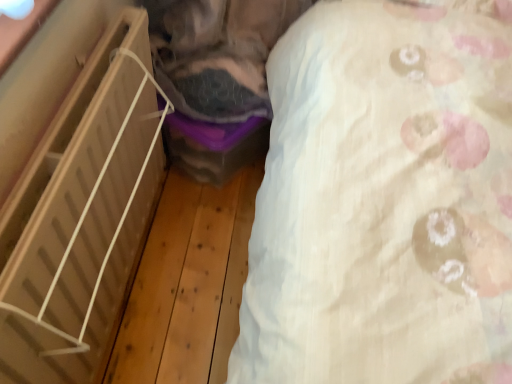
Where is `white textured sheet at upper right`? The width and height of the screenshot is (512, 384). white textured sheet at upper right is located at coordinates (384, 200).

This screenshot has width=512, height=384. What do you see at coordinates (384, 200) in the screenshot?
I see `white textured sheet at upper right` at bounding box center [384, 200].

Measure the distance between point (157, 134) and camera.

Point (157, 134) and camera are 4.38 feet apart.

This screenshot has height=384, width=512. What do you see at coordinates (80, 216) in the screenshot?
I see `light wood shelf at left` at bounding box center [80, 216].

At what (x,y) coordinates should I click in order to perform the action: click on light wood shelf at left. Please return your answer as a coordinate pair (x, y). Looking at the image, I should click on (80, 216).

This screenshot has width=512, height=384. Identify the location of white textured sheet at upper right. (384, 200).

Does light wood shelf at left appear on the right side of white textured sheet at upper right?

Incorrect, light wood shelf at left is not on the right side of white textured sheet at upper right.

Is light wood shelf at left in front of or behind white textured sheet at upper right in the image?

light wood shelf at left is behind white textured sheet at upper right.

Is point (25, 218) farther from viewer compared to point (430, 176)?

No, (25, 218) is closer to viewer.

From the image's perspective, would you say light wood shelf at left is shown under white textured sheet at upper right?

Yes, from the image's perspective, light wood shelf at left is below white textured sheet at upper right.

From a real-world perspective, is light wood shelf at left positioned over white textured sheet at upper right based on gravity?

Incorrect, from a real-world perspective, light wood shelf at left is lower than white textured sheet at upper right.

Considering the sizes of objects light wood shelf at left and white textured sheet at upper right in the image provided, who is thinner, light wood shelf at left or white textured sheet at upper right?

Thinner between the two is white textured sheet at upper right.

Considering the sizes of objects light wood shelf at left and white textured sheet at upper right in the image provided, who is taller, light wood shelf at left or white textured sheet at upper right?

With more height is white textured sheet at upper right.

Is light wood shelf at left bigger or smaller than white textured sheet at upper right?

In the image, light wood shelf at left appears to be larger than white textured sheet at upper right.

Is light wood shelf at left inside the boundaries of white textured sheet at upper right, or outside?

light wood shelf at left is not enclosed by white textured sheet at upper right.

Does light wood shelf at left touch white textured sheet at upper right?

They are not placed beside each other.

Is white textured sheet at upper right at the back of light wood shelf at left?

No, white textured sheet at upper right is not at the back of light wood shelf at left.

Measure the distance from light wood shelf at left to white textured sheet at upper right.

They are 20.95 inches apart.

The height and width of the screenshot is (384, 512). Find the location of `furniture behind the white textured sheet at upper right`. furniture behind the white textured sheet at upper right is located at coordinates (80, 216).

Which is more to the right, white textured sheet at upper right or light wood shelf at left?

white textured sheet at upper right.

Relative to light wood shelf at left, is white textured sheet at upper right in front or behind?

In the image, white textured sheet at upper right appears in front of light wood shelf at left.

Considering the positions of point (358, 340) and point (148, 184), is point (358, 340) closer or farther from the camera than point (148, 184)?

Point (358, 340).

From the image's perspective, is white textured sheet at upper right above or below light wood shelf at left?

Clearly, from the image's perspective, white textured sheet at upper right is above light wood shelf at left.

From a real-world perspective, is white textured sheet at upper right physically above light wood shelf at left?

Yes.

Between white textured sheet at upper right and light wood shelf at left, which one has larger width?

light wood shelf at left.

Which of these two, white textured sheet at upper right or light wood shelf at left, stands shorter?

With less height is light wood shelf at left.

Which of these two, white textured sheet at upper right or light wood shelf at left, is bigger?

light wood shelf at left is bigger.

Is white textured sheet at upper right inside the boundaries of light wood shelf at left, or outside?

white textured sheet at upper right exists outside the volume of light wood shelf at left.

Is white textured sheet at upper right not near light wood shelf at left?

No, white textured sheet at upper right is in close proximity to light wood shelf at left.

Does white textured sheet at upper right turn towards light wood shelf at left?

Yes, white textured sheet at upper right is oriented towards light wood shelf at left.

What's the angular difference between white textured sheet at upper right and light wood shelf at left's facing directions?

The facing directions of white textured sheet at upper right and light wood shelf at left are 0.999 degrees apart.

Measure the distance from white textured sheet at upper right to light wood shelf at left.

white textured sheet at upper right is 20.95 inches from light wood shelf at left.

There is a light wood shelf at left. Identify the location of sheet above it (from a real-world perspective). The image size is (512, 384). (384, 200).

At what (x,y) coordinates should I click in order to perform the action: click on furniture below the white textured sheet at upper right (from a real-world perspective). Please return your answer as a coordinate pair (x, y). Looking at the image, I should click on (80, 216).

Where is `sheet on the right of the light wood shelf at left`? This screenshot has height=384, width=512. sheet on the right of the light wood shelf at left is located at coordinates (384, 200).